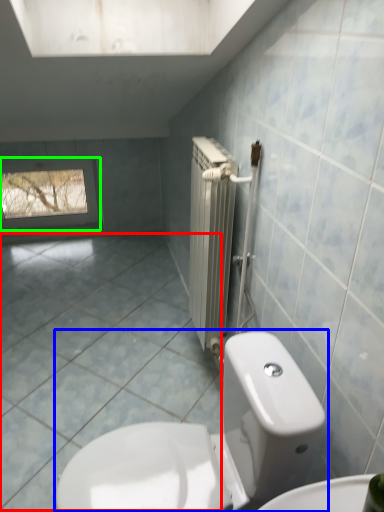
Question: Which is nearer to the ceramic tile (highlighted by a red box)? toilet (highlighted by a blue box) or window (highlighted by a green box).

Choices:
 (A) toilet
 (B) window

Answer: (A)